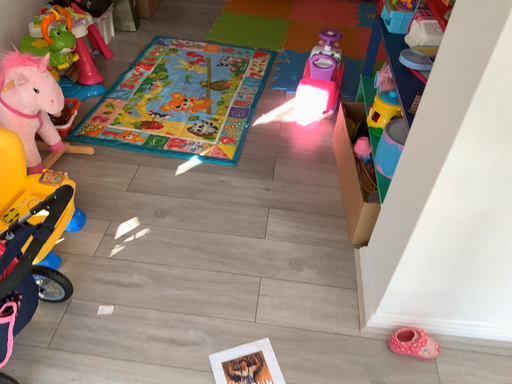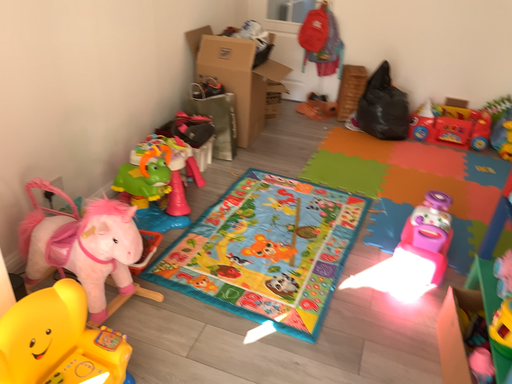
Question: Which way did the camera rotate in the video?

Choices:
 (A) rotated right
 (B) rotated left

Answer: (B)